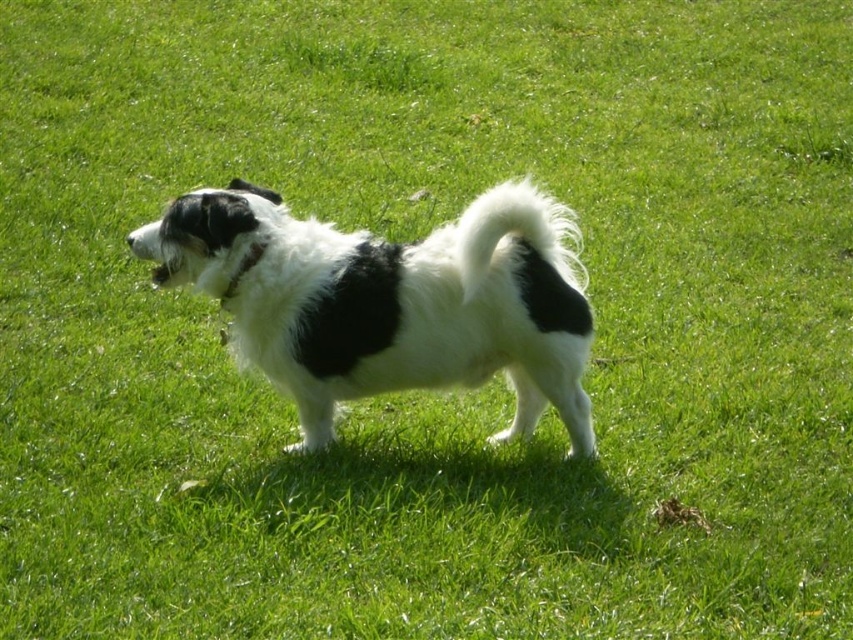
Question: Which point is farther from the camera taking this photo?

Choices:
 (A) (259, 241)
 (B) (491, 252)

Answer: (A)

Question: Does white fluffy tail at center appear on the right side of black fabric neckband at center?

Choices:
 (A) yes
 (B) no

Answer: (A)

Question: Which point is farther to the camera?

Choices:
 (A) (463, 260)
 (B) (254, 253)

Answer: (B)

Question: Which is nearer to the black-and-white fur dog at center?

Choices:
 (A) white fluffy tail at center
 (B) black fabric neckband at center

Answer: (B)

Question: Is black-and-white fur dog at center smaller than black fabric neckband at center?

Choices:
 (A) yes
 (B) no

Answer: (B)

Question: Where is black-and-white fur dog at center located in relation to white fluffy tail at center in the image?

Choices:
 (A) above
 (B) below

Answer: (B)